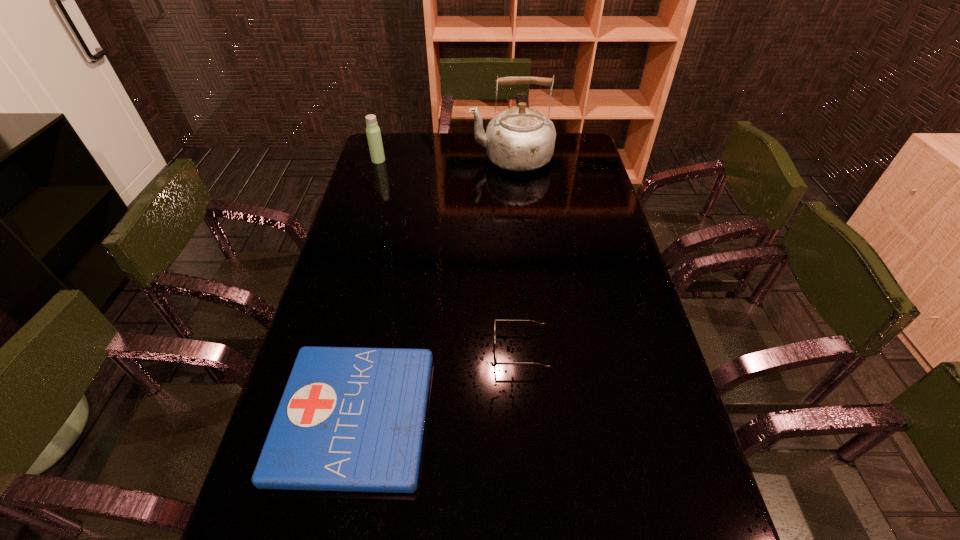
Identify which object is located as the second nearest to the sunglasses. Please provide its 2D coordinates. Your answer should be formatted as a tuple, i.e. [(x, y)], where the tuple contains the x and y coordinates of a point satisfying the conditions above.

[(519, 139)]

Identify which object is the closest to the sunglasses. Please provide its 2D coordinates. Your answer should be formatted as a tuple, i.e. [(x, y)], where the tuple contains the x and y coordinates of a point satisfying the conditions above.

[(352, 419)]

Find the location of a particular element. This screenshot has height=540, width=960. vacant space that satisfies the following two spatial constraints: 1. on the front lenses of the sunglasses; 2. on the front side of the first-aid kit is located at coordinates (526, 416).

This screenshot has width=960, height=540. I want to click on free space that satisfies the following two spatial constraints: 1. on the back side of the first-aid kit; 2. at the spout of the kettle, so click(409, 158).